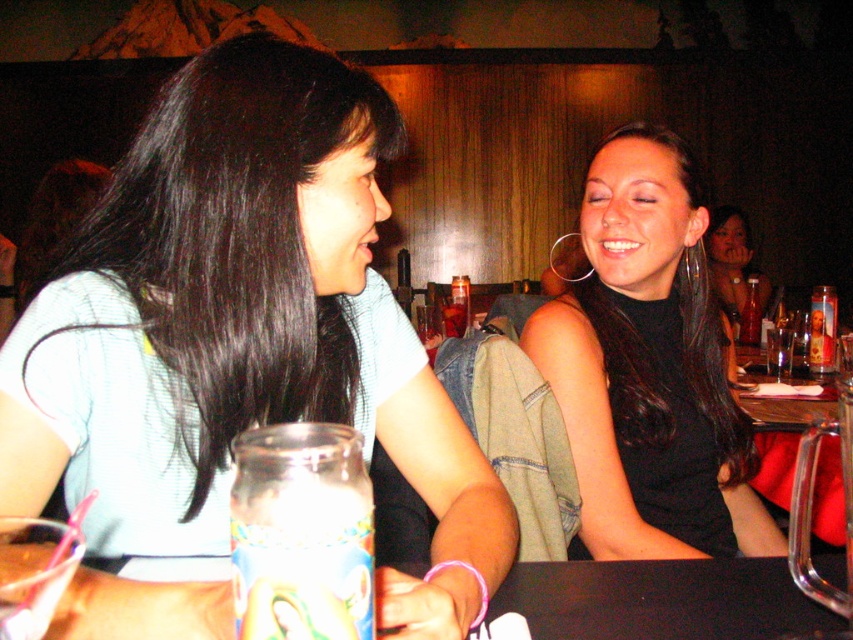
Is black matte dress at center closer to camera compared to black matte table at lower center?

No, black matte dress at center is behind black matte table at lower center.

Who is more distant from viewer, (614, 170) or (546, 605)?

Point (614, 170)

Find the location of a particular element. This screenshot has height=640, width=853. black matte dress at center is located at coordinates (648, 368).

Which of these two, matte blue shirt at upper left or matte black dress at center, stands taller?

matte black dress at center

In the scene shown: Which of these two, matte blue shirt at upper left or matte black dress at center, stands shorter?

With less height is matte blue shirt at upper left.

Is point (154, 136) less distant than point (740, 259)?

Yes.

This screenshot has width=853, height=640. In order to click on matte blue shirt at upper left in this screenshot , I will do `click(242, 330)`.

Is matte blue shirt at upper left positioned behind smooth wooden table at center?

No, matte blue shirt at upper left is in front of smooth wooden table at center.

Is matte blue shirt at upper left above smooth wooden table at center?

Indeed, matte blue shirt at upper left is positioned over smooth wooden table at center.

Between point (180, 477) and point (750, 369), which one is positioned behind?

The point (750, 369) is more distant.

This screenshot has height=640, width=853. I want to click on matte blue shirt at upper left, so click(x=242, y=330).